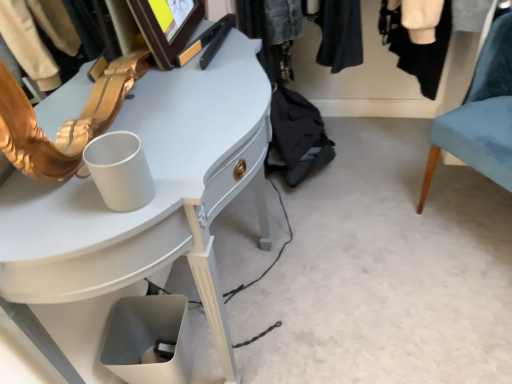
This screenshot has width=512, height=384. Find the location of `vacant space in white glossy desk at upper left (from a real-world perspective)`. vacant space in white glossy desk at upper left (from a real-world perspective) is located at coordinates (242, 292).